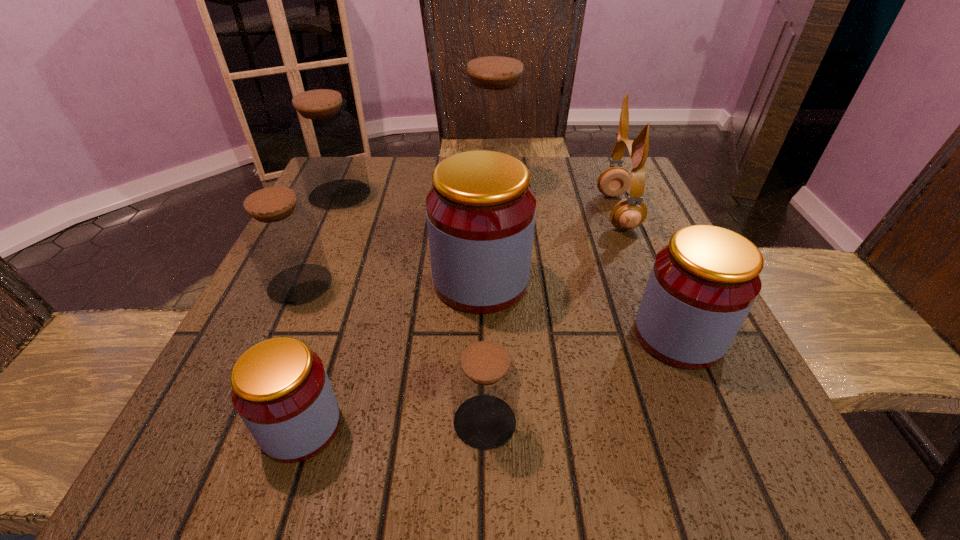
In order to click on blank area located 0.190m on the left of the tallest jar in this screenshot , I will do `click(380, 181)`.

The width and height of the screenshot is (960, 540). I want to click on free spot located 0.180m on the front-facing side of the earphone, so click(519, 212).

Find the location of a particular element. This screenshot has width=960, height=540. vacant area located 0.080m on the front-facing side of the earphone is located at coordinates (564, 212).

The image size is (960, 540). What are the coordinates of `blank space located on the front-facing side of the earphone` in the screenshot? It's located at (478, 212).

The height and width of the screenshot is (540, 960). Identify the location of vacant space situated on the front of the second biggest brown jar. (302, 278).

Image resolution: width=960 pixels, height=540 pixels. I want to click on vacant space situated on the back of the second red jar from left to right, so click(x=481, y=173).

Where is `free space located on the front of the second nearest brown jar`? free space located on the front of the second nearest brown jar is located at coordinates (278, 333).

Where is `free space located on the left of the second smallest red jar`? free space located on the left of the second smallest red jar is located at coordinates (406, 335).

Where is `vacant space located 0.090m on the left of the smallest red jar`? The image size is (960, 540). vacant space located 0.090m on the left of the smallest red jar is located at coordinates (196, 426).

You are a GUI agent. You are given a task and a screenshot of the screen. Output one action in this format:
    pyautogui.click(x=<x>, y=<y>)
    Task: Click on the vacant space located on the back of the smallest brown jar
    The height and width of the screenshot is (540, 960).
    Given the screenshot: What is the action you would take?
    pyautogui.click(x=484, y=309)